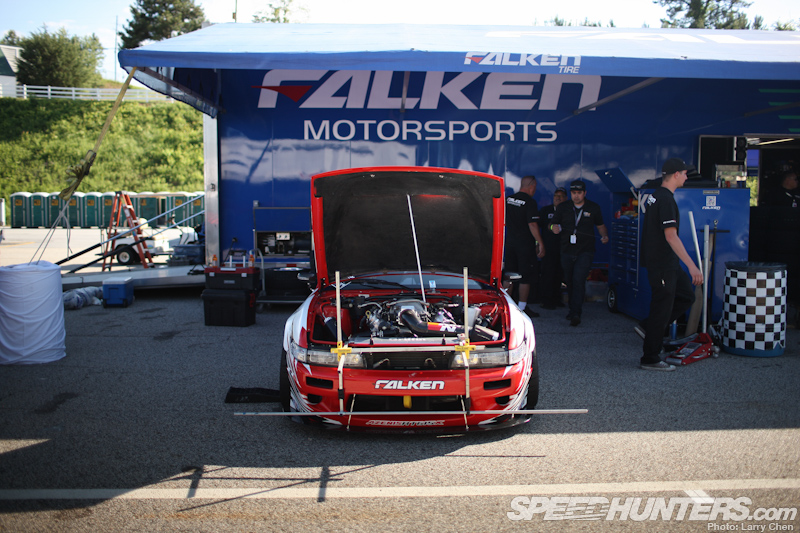
Locate an element on the screen. hood is located at coordinates (381, 227).